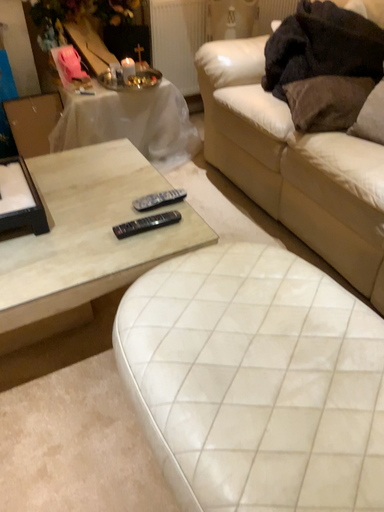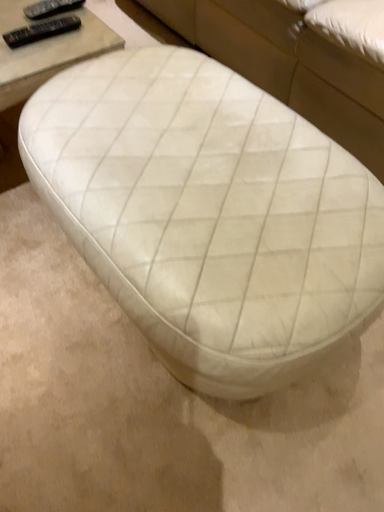
Question: How did the camera likely rotate when shooting the video?

Choices:
 (A) rotated downward
 (B) rotated upward

Answer: (A)